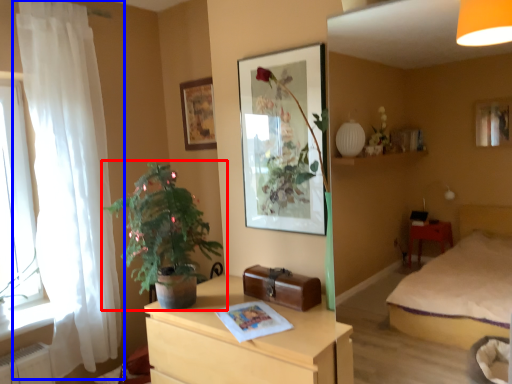
Question: Among these objects, which one is nearest to the camera, houseplant (highlighted by a red box) or curtain (highlighted by a blue box)?

Choices:
 (A) houseplant
 (B) curtain

Answer: (A)